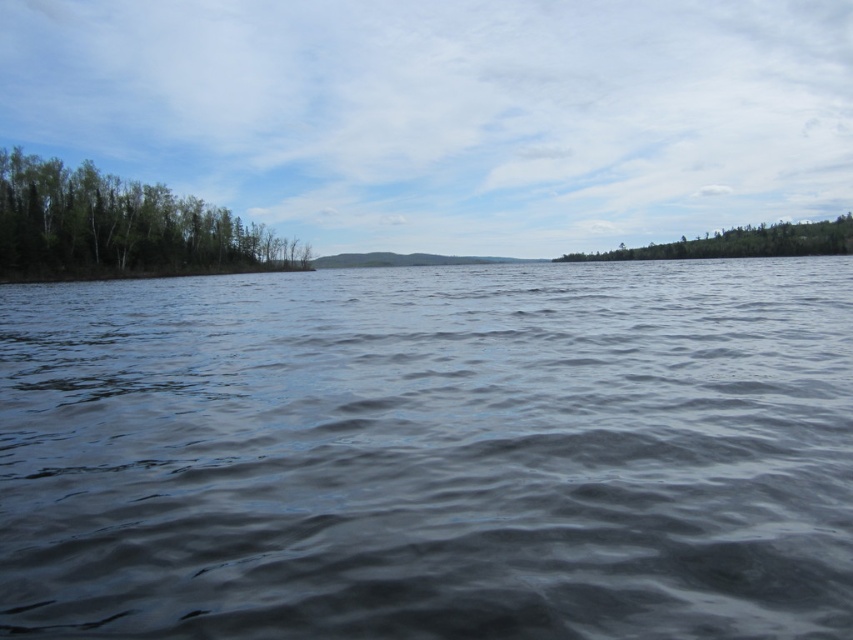
From the picture: Between transparent water at center and green leafy trees at right, which one appears on the left side from the viewer's perspective?

transparent water at center

Is transparent water at center smaller than green leafy trees at right?

Incorrect, transparent water at center is not smaller in size than green leafy trees at right.

Image resolution: width=853 pixels, height=640 pixels. I want to click on transparent water at center, so click(x=448, y=113).

Is point (683, 570) farther from viewer compared to point (6, 186)?

No, (683, 570) is in front of (6, 186).

Who is shorter, dark blue water at center or green leafy trees at left?

Standing shorter between the two is dark blue water at center.

The height and width of the screenshot is (640, 853). I want to click on dark blue water at center, so click(x=431, y=452).

Is green leafy trees at left above green leafy trees at right?

Actually, green leafy trees at left is below green leafy trees at right.

Is green leafy trees at left to the right of green leafy trees at right from the viewer's perspective?

In fact, green leafy trees at left is to the left of green leafy trees at right.

Is point (84, 204) closer to viewer compared to point (660, 259)?

That is True.

This screenshot has height=640, width=853. I want to click on green leafy trees at left, so click(119, 227).